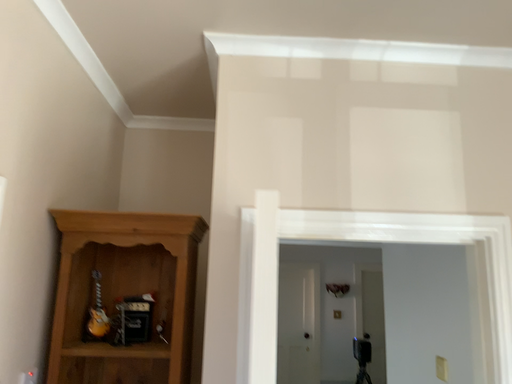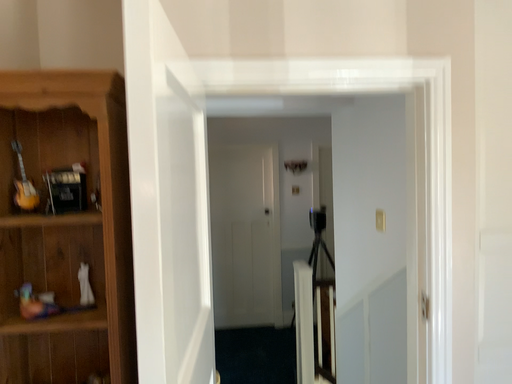
Question: How did the camera likely rotate when shooting the video?

Choices:
 (A) rotated upward
 (B) rotated downward

Answer: (B)